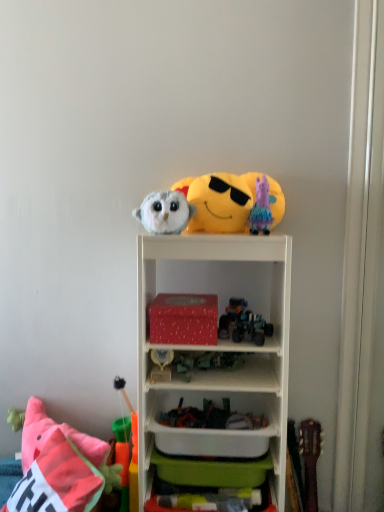
In order to click on free space in front of yellow plush emoji at upper center, which is the 1th toy in top-to-bottom order in this screenshot , I will do (227, 241).